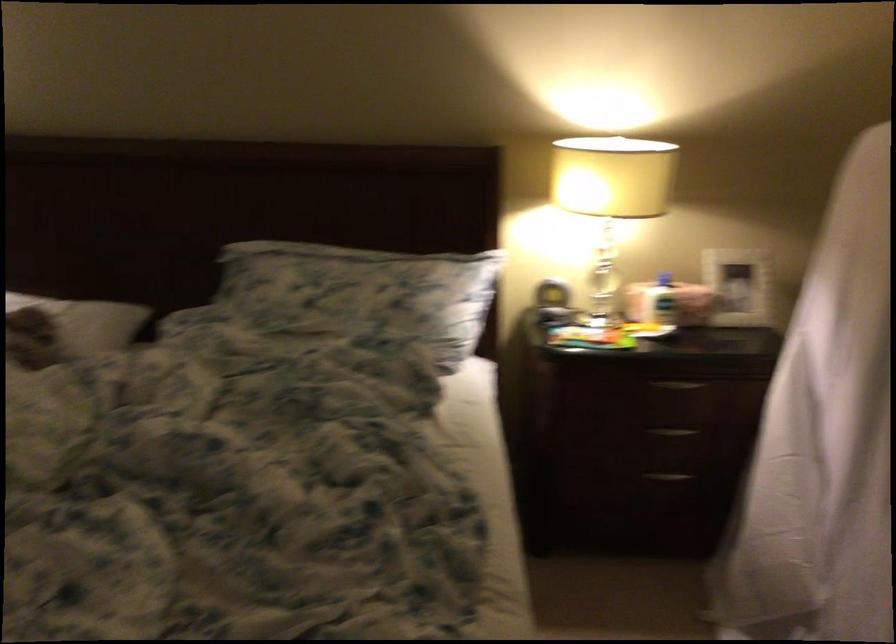
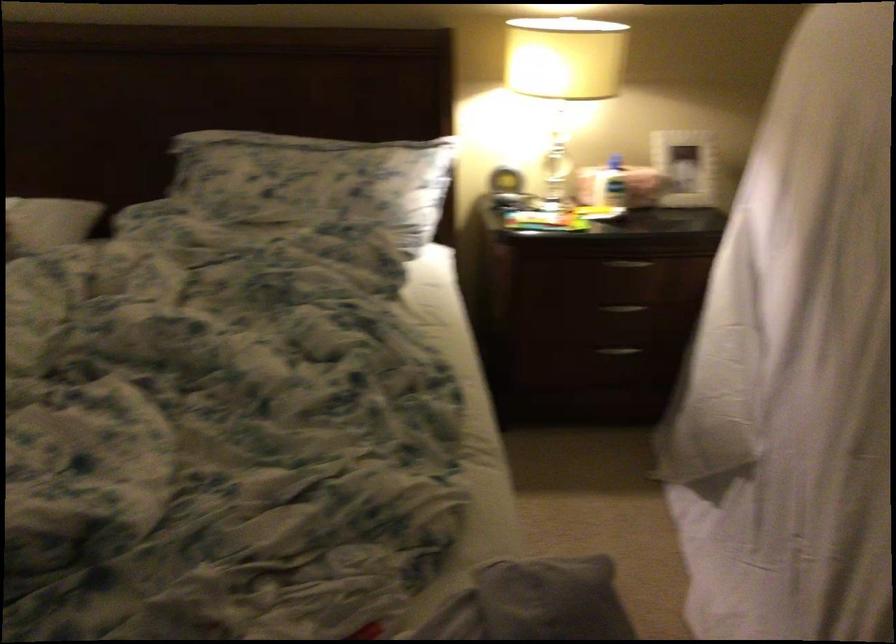
In a continuous first-person perspective shot, in which direction is the camera moving?

The cameraman walked toward left, backward.